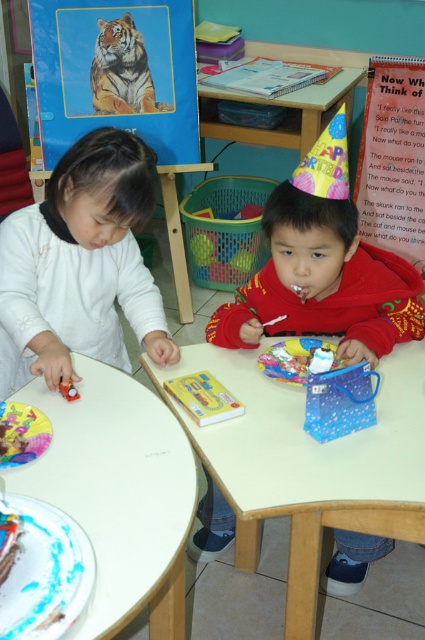
Is white matte shirt at left shorter than red velvet cake at upper center?

No, white matte shirt at left is not shorter than red velvet cake at upper center.

Is white matte shirt at left taller than red velvet cake at upper center?

Yes.

Is point (17, 221) positioned behind point (232, 321)?

No, (17, 221) is closer to viewer.

You are a GUI agent. You are given a task and a screenshot of the screen. Output one action in this format:
    pyautogui.click(x=<x>, y=<y>)
    Task: Click on the white matte shirt at left
    
    Given the screenshot: What is the action you would take?
    pyautogui.click(x=84, y=260)

Does white glossy table at center have a greater width compared to wooden table at upper center?

No, white glossy table at center is not wider than wooden table at upper center.

Is white glossy table at center thinner than wooden table at upper center?

Yes.

At what (x,y) coordinates should I click in order to perform the action: click on white glossy table at center. Please return your answer as a coordinate pair (x, y). Image resolution: width=425 pixels, height=640 pixels. Looking at the image, I should click on (308, 464).

Does red velvet cake at upper center have a greater height compared to wooden table at upper center?

Incorrect, red velvet cake at upper center's height is not larger of wooden table at upper center's.

Looking at this image, is red velvet cake at upper center to the left of wooden table at upper center from the viewer's perspective?

Yes, red velvet cake at upper center is to the left of wooden table at upper center.

Identify the location of red velvet cake at upper center. (x=323, y=284).